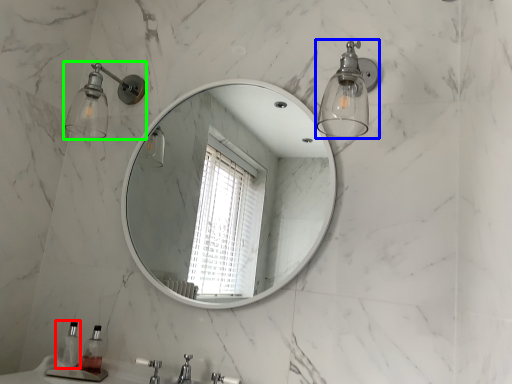
Question: Which object is the farthest from soap dispenser (highlighted by a red box)? Choose among these: light fixture (highlighted by a blue box) or shower (highlighted by a green box).

Choices:
 (A) light fixture
 (B) shower

Answer: (A)